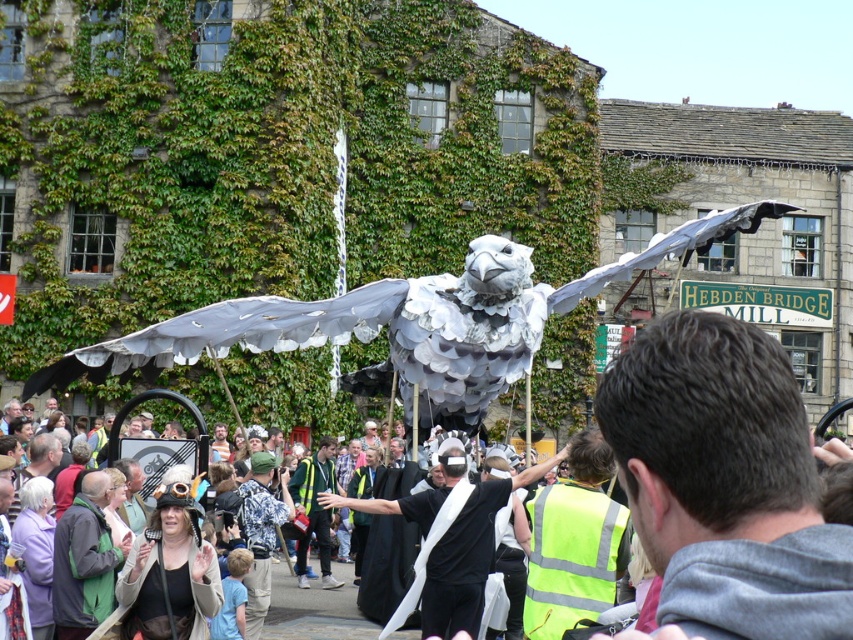
You are standing in the street scene and want to know how far the point at coordinates (392, 504) is from you. Can you determine the distance?

The point at coordinates (392, 504) is 67.13 meters away from the viewer.

You are a photographer standing in the middle of the street. You want to take a photo that includes both the dark gray hair at center and the silver metallic eagle at center. Given that your camera has a maximum focus range of 30 meters, will you be able to capture both subjects in focus at the same time?

The dark gray hair at center and the silver metallic eagle at center are 32.19 meters apart. Since the distance between them exceeds the camera maximum focus range of 30 meters, you cannot capture both subjects in focus simultaneously.